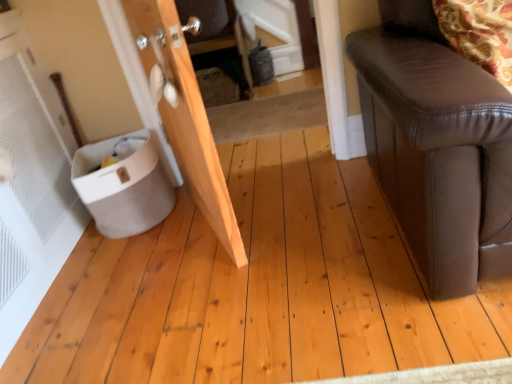
Question: From a real-world perspective, is natural wood door at left over white fabric potty at lower left?

Choices:
 (A) yes
 (B) no

Answer: (A)

Question: Is natural wood door at left in front of white fabric potty at lower left?

Choices:
 (A) yes
 (B) no

Answer: (A)

Question: Considering the relative sizes of natural wood door at left and white fabric potty at lower left in the image provided, is natural wood door at left wider than white fabric potty at lower left?

Choices:
 (A) no
 (B) yes

Answer: (A)

Question: Is white fabric potty at lower left surrounded by natural wood door at left?

Choices:
 (A) no
 (B) yes

Answer: (A)

Question: Does natural wood door at left have a greater height compared to white fabric potty at lower left?

Choices:
 (A) no
 (B) yes

Answer: (B)

Question: From a real-world perspective, is natural wood door at left physically below white fabric potty at lower left?

Choices:
 (A) no
 (B) yes

Answer: (A)

Question: Does white fabric potty at lower left have a lesser width compared to natural wood door at left?

Choices:
 (A) yes
 (B) no

Answer: (B)

Question: From a real-world perspective, is white fabric potty at lower left located higher than natural wood door at left?

Choices:
 (A) yes
 (B) no

Answer: (B)

Question: Is white fabric potty at lower left at the left side of natural wood door at left?

Choices:
 (A) no
 (B) yes

Answer: (B)

Question: From the image's perspective, does white fabric potty at lower left appear lower than natural wood door at left?

Choices:
 (A) yes
 (B) no

Answer: (A)

Question: Are white fabric potty at lower left and natural wood door at left far apart?

Choices:
 (A) yes
 (B) no

Answer: (B)

Question: Is the depth of white fabric potty at lower left less than that of natural wood door at left?

Choices:
 (A) yes
 (B) no

Answer: (B)

Question: Is natural wood door at left in front of or behind white fabric potty at lower left in the image?

Choices:
 (A) behind
 (B) front

Answer: (B)